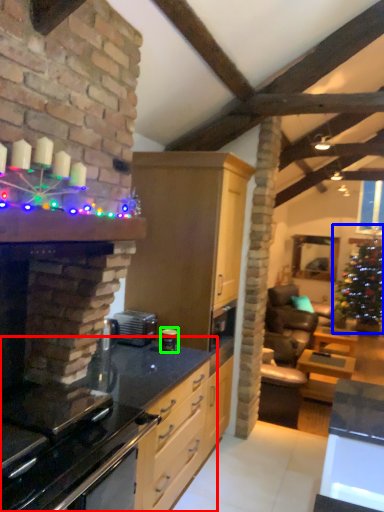
Question: Considering the real-world distances, which object is farthest from countertop (highlighted by a red box)? christmas tree (highlighted by a blue box) or appliance (highlighted by a green box)?

Choices:
 (A) christmas tree
 (B) appliance

Answer: (A)